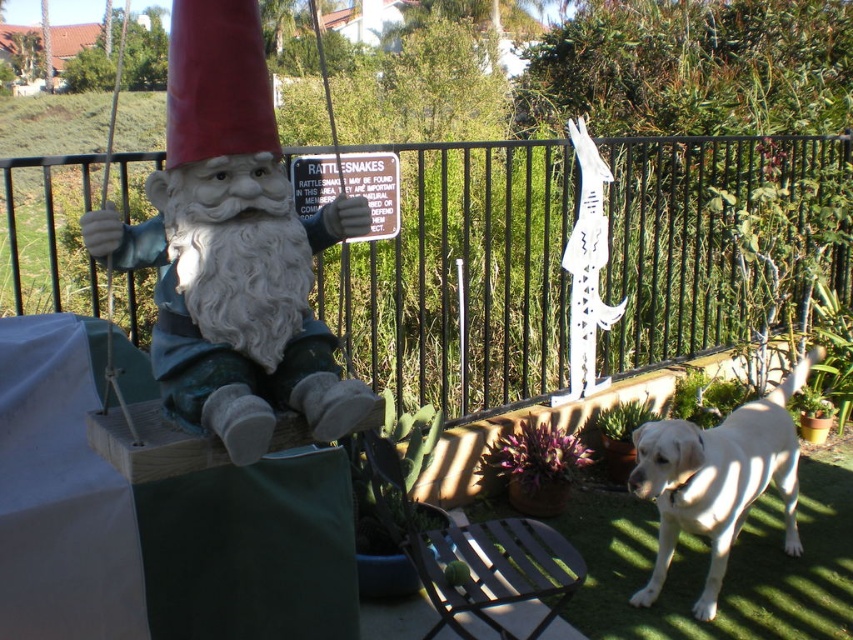
You are a child visiting the garden and want to sit on the metallic silver chair at center. Can you sit on it without the matte ceramic gnome at left blocking your view?

The matte ceramic gnome at left is taller than the metallic silver chair at center, so it may block your view when sitting on the chair.

You are standing at the center of the garden and want to place a new decorative item. You have a small potted plant that needs to be placed exactly at point (x=233, y=248). What object is currently located at that point?

The point (x=233, y=248) is currently occupied by the matte ceramic gnome at left.

You are a gardener standing in the garden and want to place a new flower pot between the black metal fence at upper center and the matte ceramic gnome at left. Can you do this without moving either object?

The black metal fence at upper center is further to the viewer than the matte ceramic gnome at left, so there is space between them to place the flower pot without moving either object.